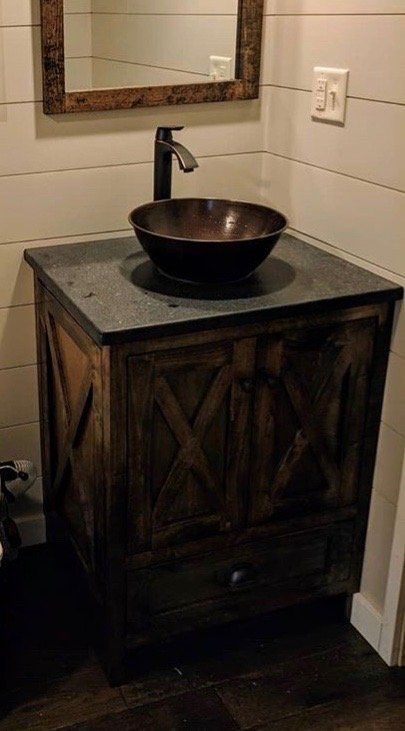
Find the location of a particular element. light switch is located at coordinates [x=333, y=94], [x=224, y=69].